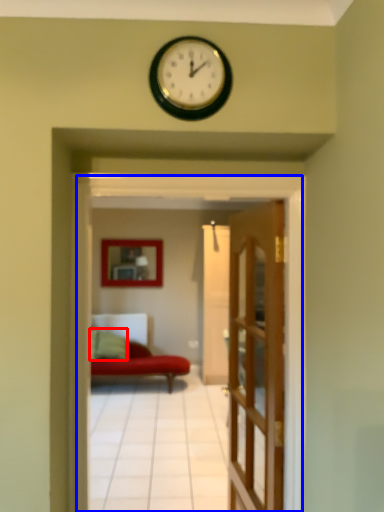
Question: Among these objects, which one is farthest to the camera, pillow (highlighted by a red box) or residence (highlighted by a blue box)?

Choices:
 (A) pillow
 (B) residence

Answer: (A)